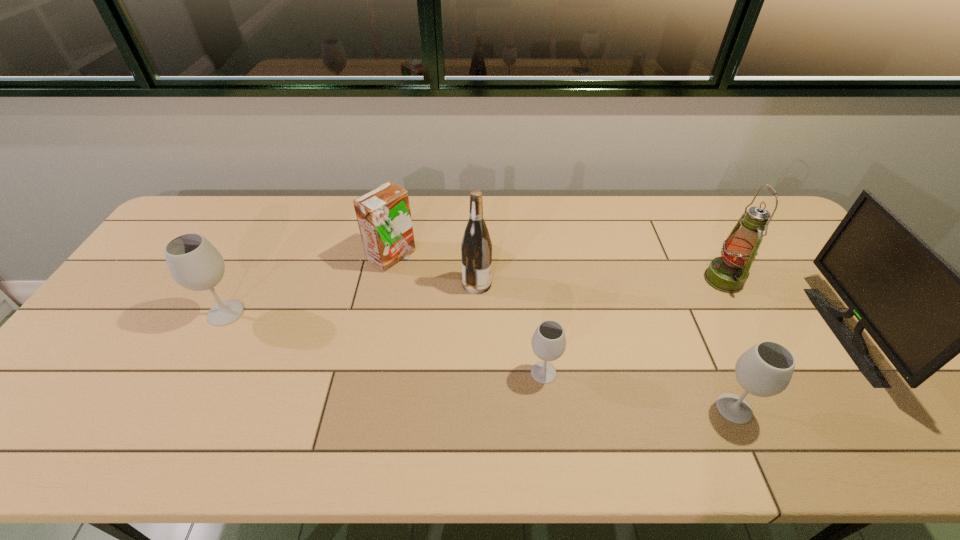
The image size is (960, 540). Identify the location of vacant region between the third object from left to right and the shortest object. (510, 328).

Locate an element on the screen. The image size is (960, 540). vacant point located between the monitor and the carton is located at coordinates (617, 295).

Image resolution: width=960 pixels, height=540 pixels. I want to click on free space that is in between the monitor and the fifth object from right to left, so point(660,309).

Image resolution: width=960 pixels, height=540 pixels. I want to click on empty space that is in between the second shortest wineglass and the wine bottle, so click(606, 346).

Image resolution: width=960 pixels, height=540 pixels. I want to click on free space between the carton and the monitor, so click(617, 295).

You are a GUI agent. You are given a task and a screenshot of the screen. Output one action in this format:
    pyautogui.click(x=<x>, y=<y>)
    Task: Click on the object that stands as the third closest to the rightmost object
    
    Given the screenshot: What is the action you would take?
    pyautogui.click(x=548, y=342)

Find the location of a particular element. object that is the second closest to the fifth object from right to left is located at coordinates (548, 342).

Where is `wineglass object that ranks as the closest to the rightmost object`? wineglass object that ranks as the closest to the rightmost object is located at coordinates (764, 370).

You are a GUI agent. You are given a task and a screenshot of the screen. Output one action in this format:
    pyautogui.click(x=<x>, y=<y>)
    Task: Click on the wineglass that is the second closest to the farthest wineglass
    
    Given the screenshot: What is the action you would take?
    pyautogui.click(x=764, y=370)

You are a GUI agent. You are given a task and a screenshot of the screen. Output one action in this format:
    pyautogui.click(x=<x>, y=<y>)
    Task: Click on the free space that satisfies the following two spatial constraints: 1. on the straw side of the carton; 2. on the left side of the shortest wineglass
    The image size is (960, 540).
    Given the screenshot: What is the action you would take?
    pyautogui.click(x=368, y=373)